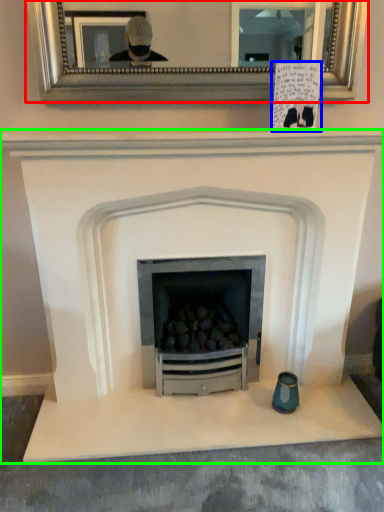
Question: Based on their relative distances, which object is farther from picture frame (highlighted by a red box)? Choose from postcard (highlighted by a blue box) and fireplace (highlighted by a green box).

Choices:
 (A) postcard
 (B) fireplace

Answer: (B)